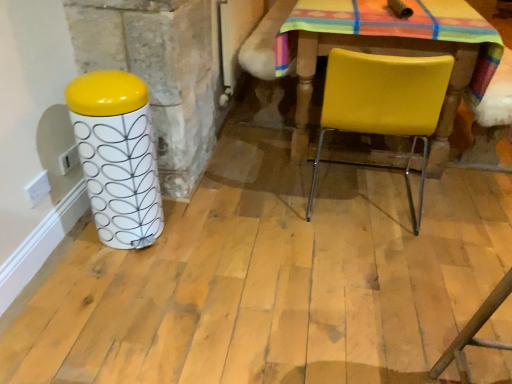
Identify the location of free space in front of yellow leather chair at center. (377, 266).